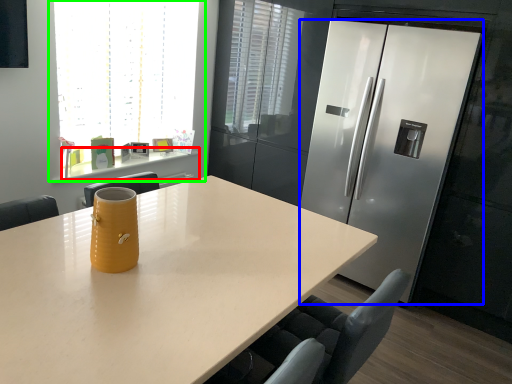
Question: Which object is the farthest from counter (highlighted by a red box)? Choose among these: refrigerator (highlighted by a blue box) or window (highlighted by a green box).

Choices:
 (A) refrigerator
 (B) window

Answer: (A)